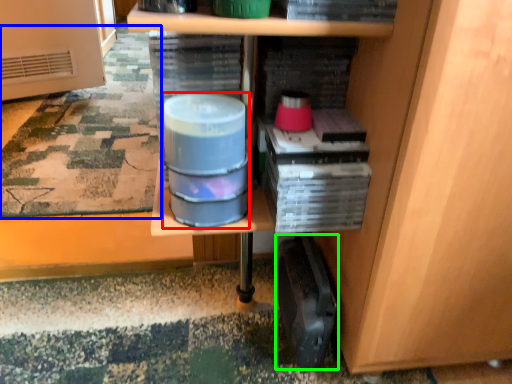
Question: Considering the real-world distances, which object is farthest from water (highlighted by a red box)? mat (highlighted by a blue box) or wide (highlighted by a green box)?

Choices:
 (A) mat
 (B) wide

Answer: (A)